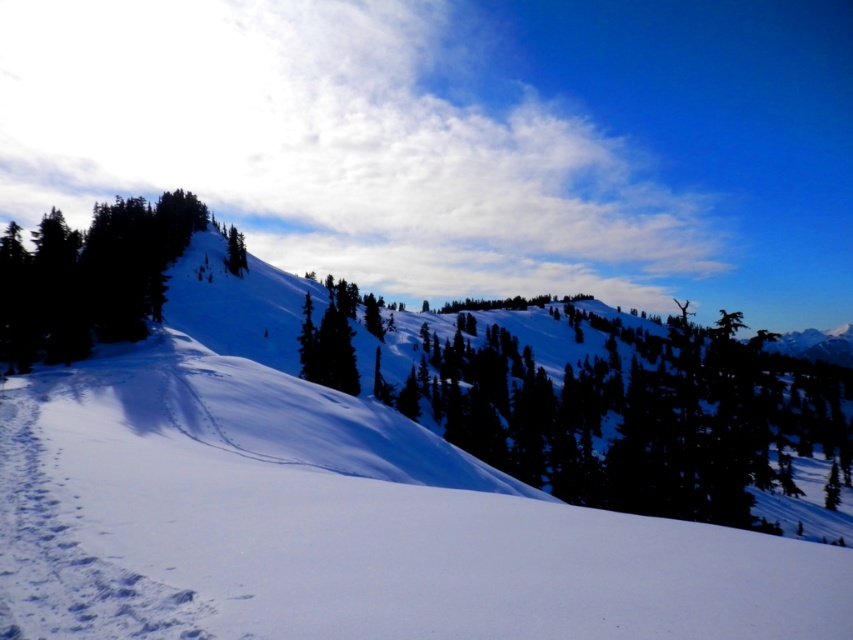
Question: Which point is farther from the camera taking this photo?

Choices:
 (A) pyautogui.click(x=306, y=362)
 (B) pyautogui.click(x=196, y=349)

Answer: (A)

Question: Which of the following is the closest to the observer?

Choices:
 (A) green matte tree at center
 (B) green matte tree at upper center
 (C) white powdery snow at center
 (D) green matte tree at upper left

Answer: (C)

Question: Does white powdery snow at center lie in front of green matte tree at upper left?

Choices:
 (A) yes
 (B) no

Answer: (A)

Question: Can you confirm if green matte tree at center is positioned below green matte tree at upper center?

Choices:
 (A) yes
 (B) no

Answer: (A)

Question: Can you confirm if green matte tree at upper left is positioned to the right of green matte tree at center?

Choices:
 (A) yes
 (B) no

Answer: (B)

Question: Estimate the real-world distances between objects in this image. Which object is farther from the green matte tree at upper left?

Choices:
 (A) green matte tree at upper center
 (B) white powdery snow at center

Answer: (B)